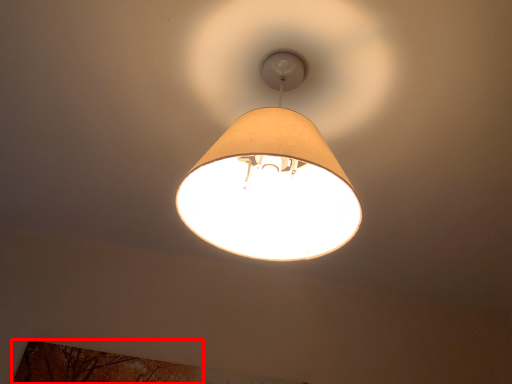
Question: From the image's perspective, where is tree (annotated by the red box) located relative to lamp?

Choices:
 (A) below
 (B) above

Answer: (A)